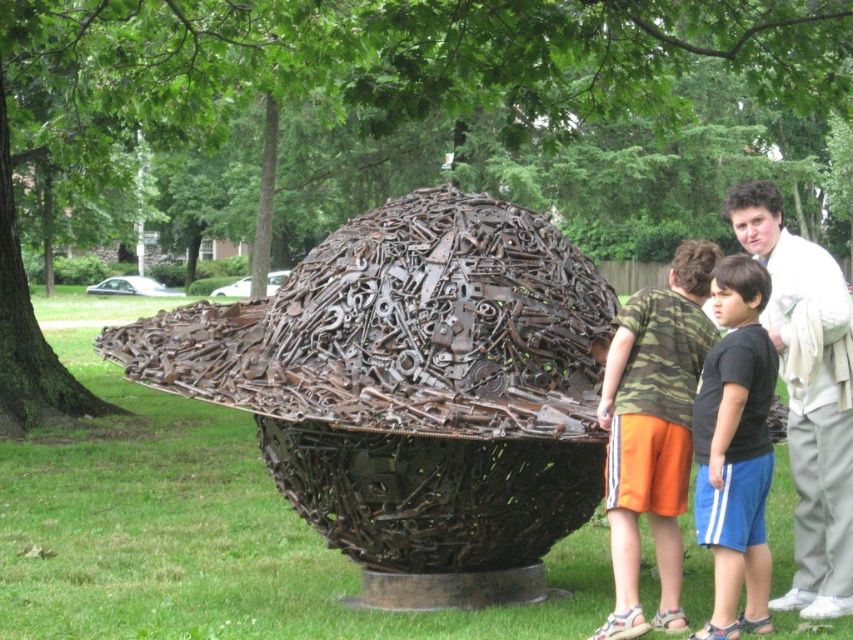
Who is positioned more to the left, rusty metal sphere at center or black cotton shirt at center?

rusty metal sphere at center

Is point (462, 280) positioned in front of point (712, 396)?

That is False.

Image resolution: width=853 pixels, height=640 pixels. I want to click on rusty metal sphere at center, so click(x=415, y=392).

Who is more forward, (460, 604) or (641, 296)?

Point (641, 296) is more forward.

Who is taller, rusty metal sphere at center or camo fabric shorts at lower center?

rusty metal sphere at center is taller.

Image resolution: width=853 pixels, height=640 pixels. Describe the element at coordinates (415, 392) in the screenshot. I see `rusty metal sphere at center` at that location.

You are a GUI agent. You are given a task and a screenshot of the screen. Output one action in this format:
    pyautogui.click(x=<x>, y=<y>)
    Task: Click on the rusty metal sphere at center
    Image resolution: width=853 pixels, height=640 pixels.
    Given the screenshot: What is the action you would take?
    pyautogui.click(x=415, y=392)

Does point (747, 216) come closer to viewer compared to point (691, 349)?

No, it is not.

Locate an element on the screen. Image resolution: width=853 pixels, height=640 pixels. white cotton shirt at right is located at coordinates (807, 394).

Does point (822, 444) lie behind point (666, 381)?

Yes, point (822, 444) is behind point (666, 381).

Identify the location of white cotton shirt at right. pyautogui.click(x=807, y=394).